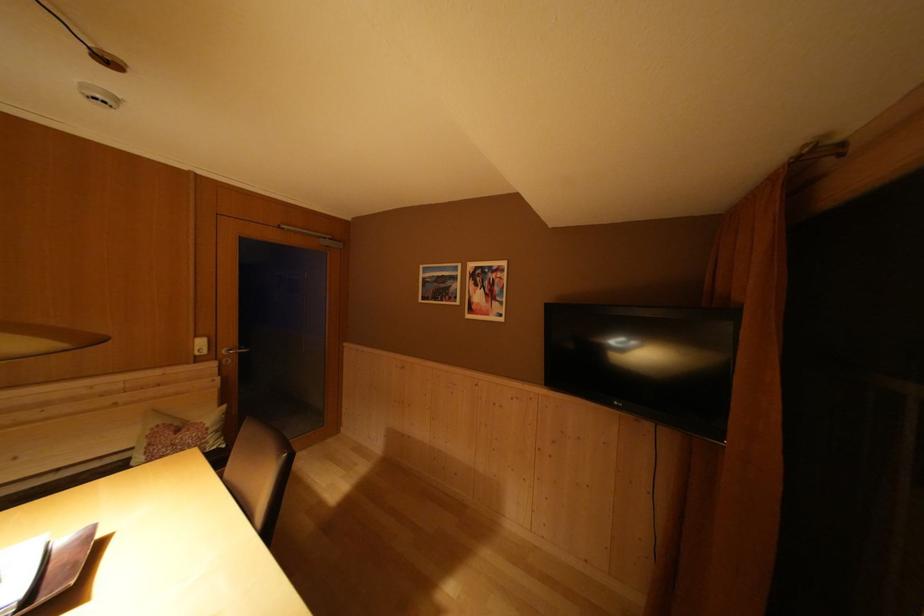
You are a GUI agent. You are given a task and a screenshot of the screen. Output one action in this format:
    pyautogui.click(x=<x>, y=<y>)
    Task: Click on the sofa sitting surface
    This screenshot has width=924, height=616.
    Given the screenshot: What is the action you would take?
    pyautogui.click(x=88, y=444)